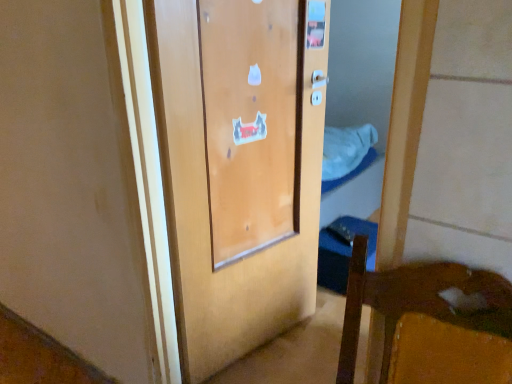
Question: In the image, is wooden door at center on the left side or the right side of white fabric at center?

Choices:
 (A) right
 (B) left

Answer: (B)

Question: From the image's perspective, relative to white fabric at center, is wooden door at center above or below?

Choices:
 (A) above
 (B) below

Answer: (B)

Question: Considering the positions of point (271, 117) and point (330, 157), is point (271, 117) closer or farther from the camera than point (330, 157)?

Choices:
 (A) closer
 (B) farther

Answer: (A)

Question: Is white fabric at center spatially inside wooden door at center, or outside of it?

Choices:
 (A) outside
 (B) inside

Answer: (A)

Question: Looking at the image, does white fabric at center seem bigger or smaller compared to wooden door at center?

Choices:
 (A) small
 (B) big

Answer: (A)

Question: From the image's perspective, relative to wooden door at center, is white fabric at center above or below?

Choices:
 (A) below
 (B) above

Answer: (B)

Question: From a real-world perspective, is white fabric at center physically located above or below wooden door at center?

Choices:
 (A) above
 (B) below

Answer: (B)